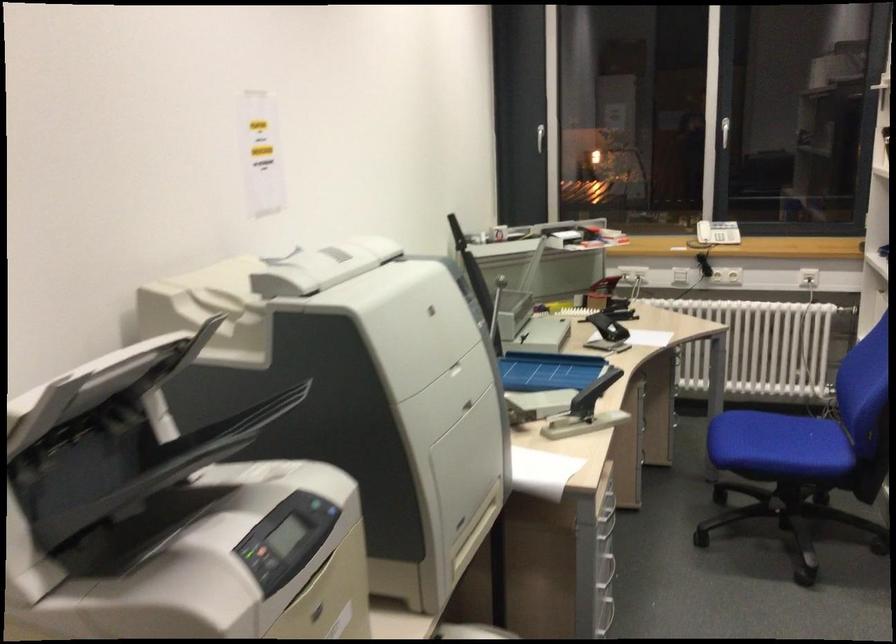
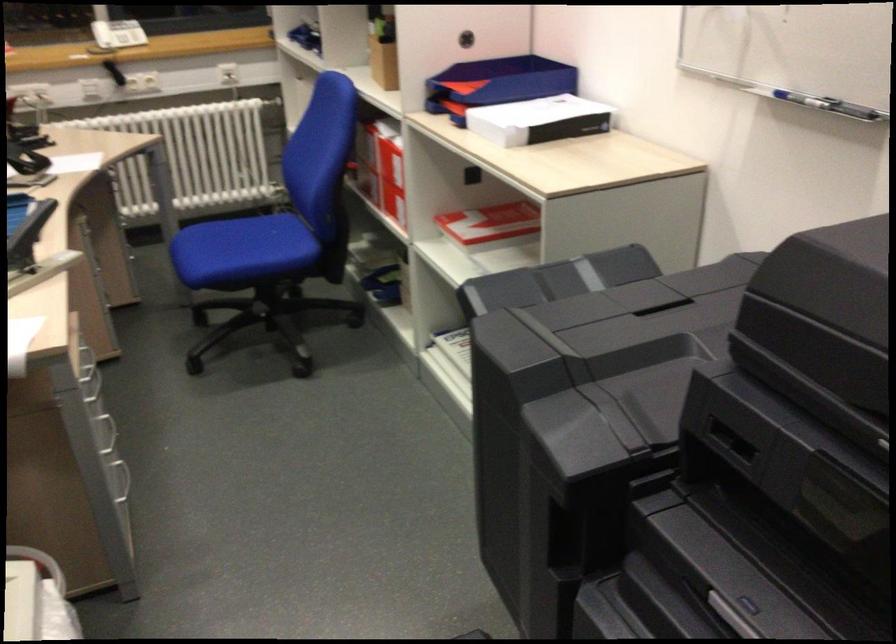
Find the pixel in the second image that matches [722,225] in the first image.

(117, 33)